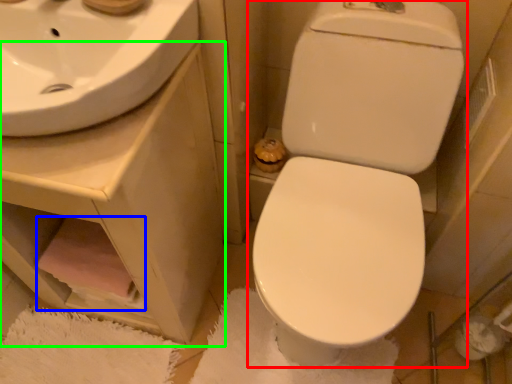
Question: Considering the real-world distances, which object is farthest from toilet (highlighted by a red box)? toilet paper (highlighted by a blue box) or counter top (highlighted by a green box)?

Choices:
 (A) toilet paper
 (B) counter top

Answer: (A)